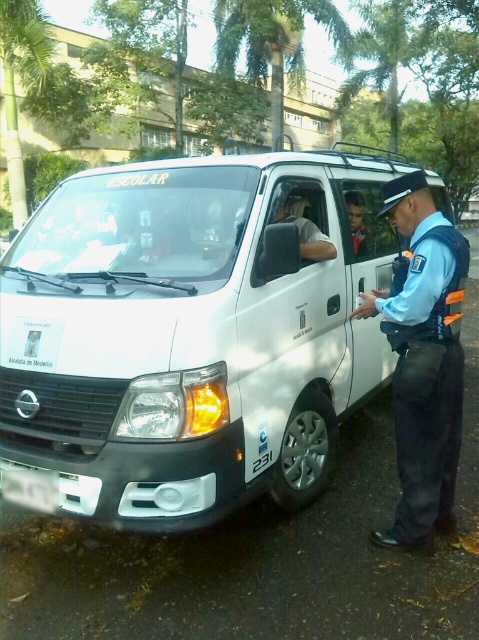
Looking at this image, who is shorter, white matte van at center or white plastic license plate at lower left?

Standing shorter between the two is white plastic license plate at lower left.

Does white matte van at center have a greater height compared to white plastic license plate at lower left?

Correct, white matte van at center is much taller as white plastic license plate at lower left.

The image size is (479, 640). I want to click on white matte van at center, so click(x=190, y=333).

Does white matte van at center have a smaller size compared to matte gray shirt at center?

Actually, white matte van at center might be larger than matte gray shirt at center.

Is white matte van at center positioned in front of matte gray shirt at center?

Yes.

You are a GUI agent. You are given a task and a screenshot of the screen. Output one action in this format:
    pyautogui.click(x=<x>, y=<y>)
    Task: Click on the white matte van at center
    This screenshot has width=479, height=640.
    Given the screenshot: What is the action you would take?
    pyautogui.click(x=190, y=333)

Is point (445, 234) positioned after point (44, 476)?

No.

Is point (440, 385) less distant than point (11, 493)?

Yes, point (440, 385) is in front of point (11, 493).

Between point (407, 461) and point (22, 468), which one is positioned behind?

The point (407, 461) is behind.

Identify the location of blue uniform at right. (423, 360).